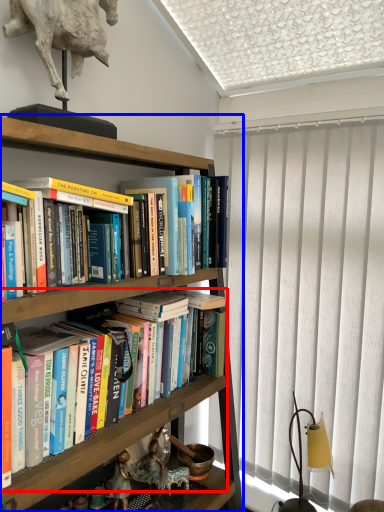
Question: Among these objects, which one is farthest to the camera, book (highlighted by a red box) or shelf (highlighted by a blue box)?

Choices:
 (A) book
 (B) shelf

Answer: (A)